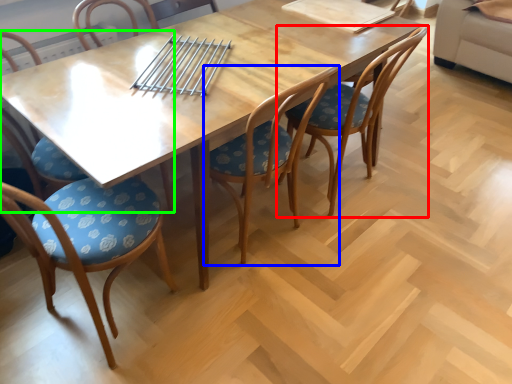
Question: Considering the real-world distances, which object is closest to chair (highlighted by a red box)? chair (highlighted by a blue box) or chair (highlighted by a green box).

Choices:
 (A) chair
 (B) chair

Answer: (A)